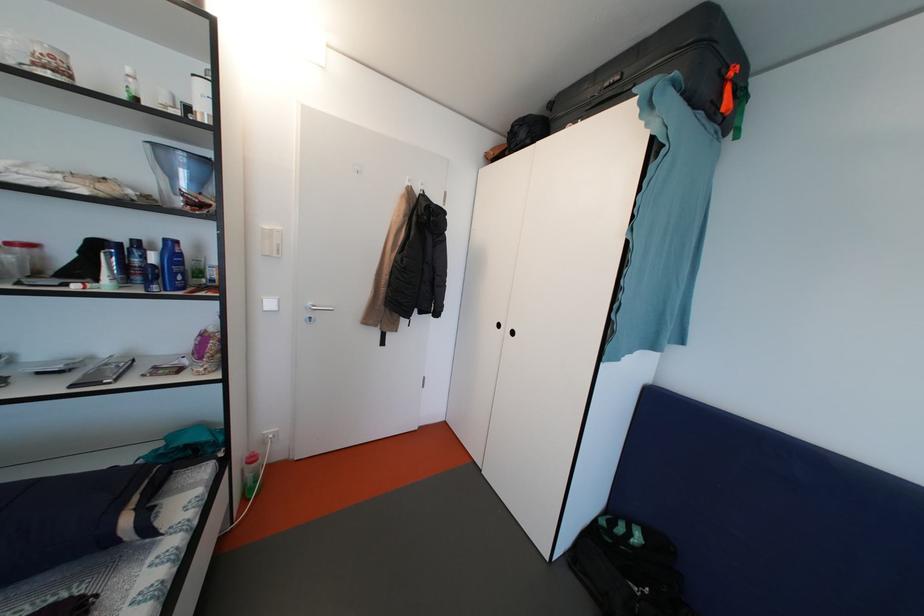
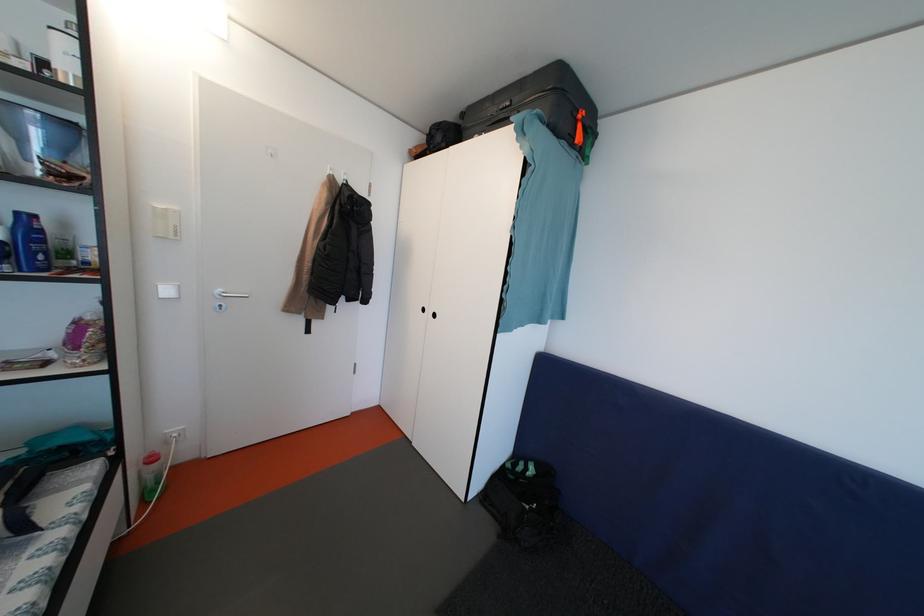
Where in the second image is the point corresponding to (187,283) from the first image?

(49, 262)